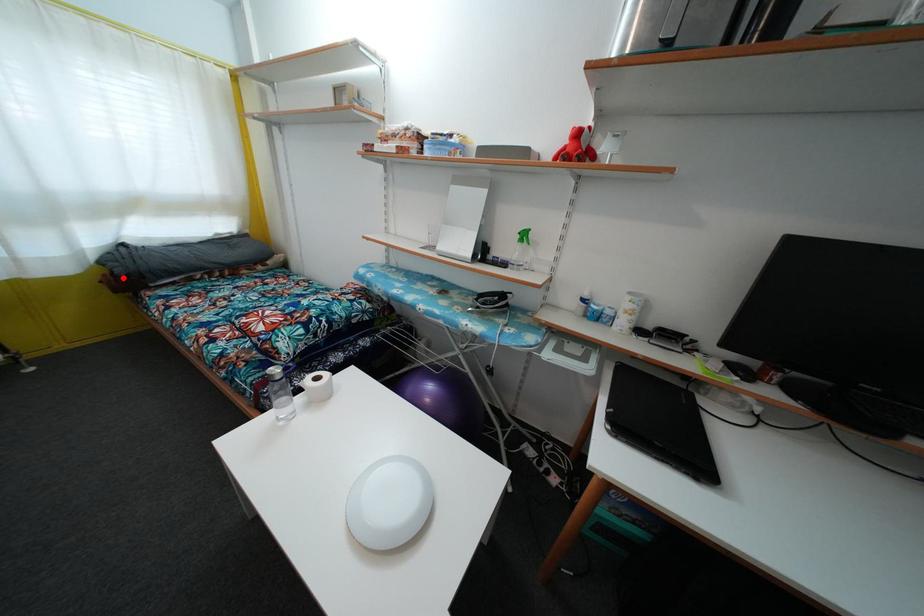
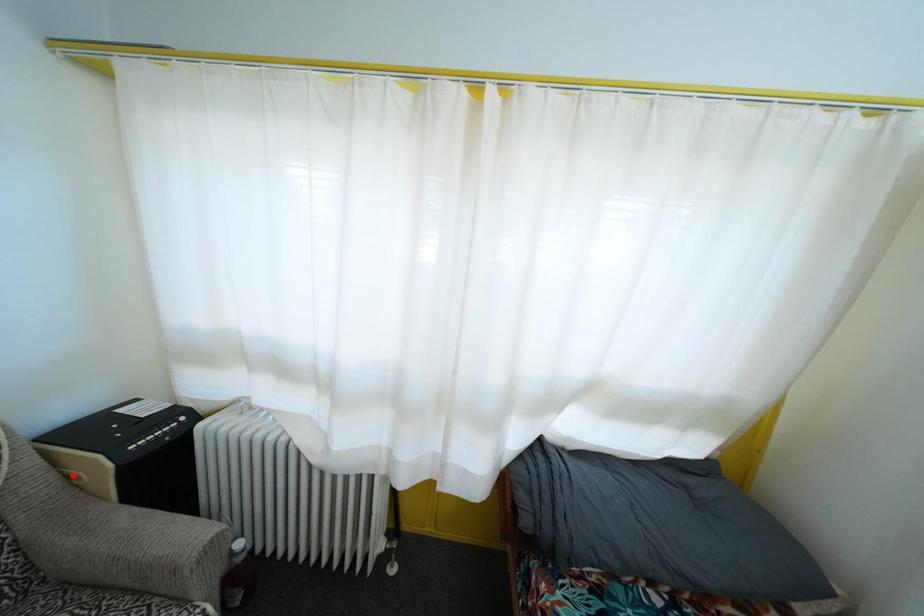
Consider the image. I am providing you with two images of the same scene from different viewpoints. A red point is marked on the first image and another point is marked on the second image. Is the marked point in image1 the same physical position as the marked point in image2?

No